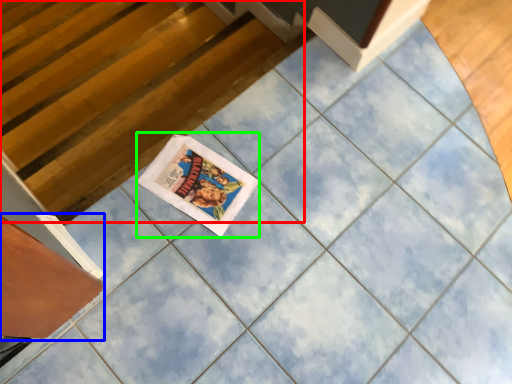
Question: Which object is positioned farthest from stairwell (highlighted by a red box)? Select from drawer (highlighted by a blue box) and comic book (highlighted by a green box).

Choices:
 (A) drawer
 (B) comic book

Answer: (A)